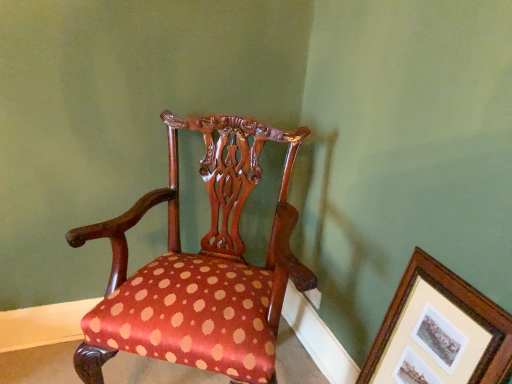
Question: Would you say polished wood chair at center is to the left or to the right of wooden picture frame at upper right in the picture?

Choices:
 (A) right
 (B) left

Answer: (B)

Question: Considering the positions of polished wood chair at center and wooden picture frame at upper right in the image, is polished wood chair at center bigger or smaller than wooden picture frame at upper right?

Choices:
 (A) big
 (B) small

Answer: (A)

Question: Do you think polished wood chair at center is within wooden picture frame at upper right, or outside of it?

Choices:
 (A) inside
 (B) outside

Answer: (B)

Question: Visually, is wooden picture frame at upper right positioned to the left or to the right of polished wood chair at center?

Choices:
 (A) left
 (B) right

Answer: (B)

Question: Is point (464, 379) positioned closer to the camera than point (238, 278)?

Choices:
 (A) closer
 (B) farther

Answer: (A)

Question: From the image's perspective, is wooden picture frame at upper right located above or below polished wood chair at center?

Choices:
 (A) below
 (B) above

Answer: (A)

Question: Is wooden picture frame at upper right in front of or behind polished wood chair at center in the image?

Choices:
 (A) behind
 (B) front

Answer: (B)